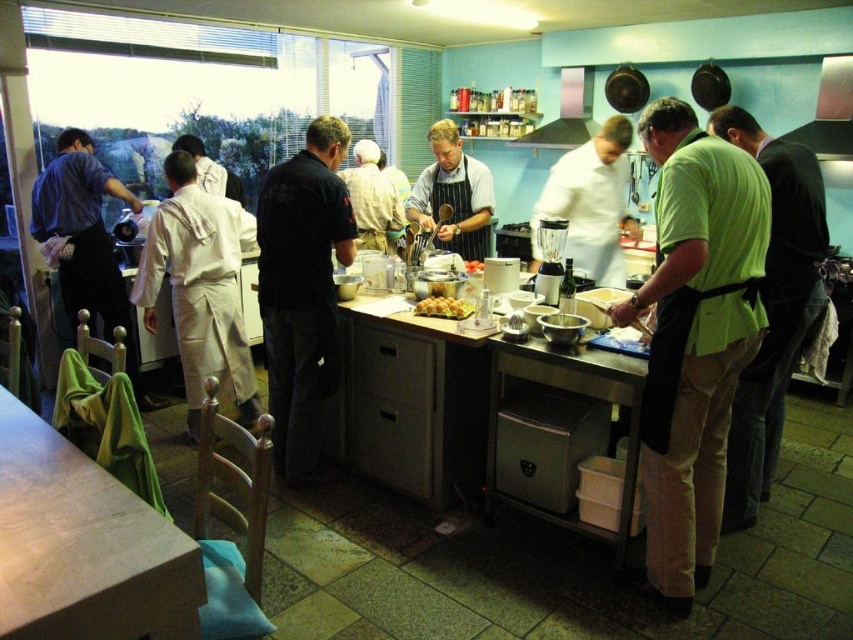
Question: Is matte black apron at left bigger than white apron chef at center?

Choices:
 (A) no
 (B) yes

Answer: (B)

Question: Which point appears closest to the camera in this image?

Choices:
 (A) (728, 440)
 (B) (73, 166)
 (C) (613, 253)
 (D) (828, 140)

Answer: (A)

Question: Is the position of green apron at center more distant than that of matte black apron at left?

Choices:
 (A) yes
 (B) no

Answer: (B)

Question: Observing the image, what is the correct spatial positioning of green matte apron at center in reference to matte black apron at left?

Choices:
 (A) right
 (B) left

Answer: (A)

Question: Which of these objects is positioned closest to the golden brown pastry at center?

Choices:
 (A) white apron chef at center
 (B) green apron at center

Answer: (A)

Question: Considering the real-world distances, which object is closest to the golden brown pastry at center?

Choices:
 (A) metallic silver exhaust hood at upper center
 (B) metallic silver exhaust hood at upper right
 (C) matte black apron at left

Answer: (C)